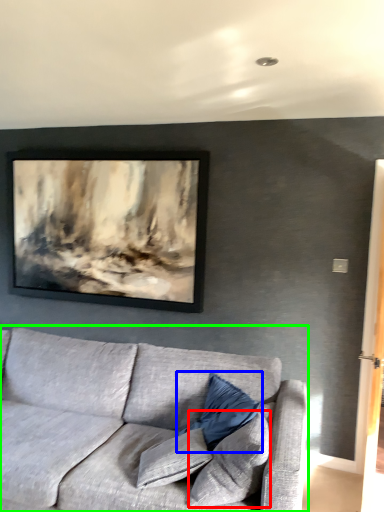
Question: Based on their relative distances, which object is farther from pillow (highlighted by a red box)? Choose from pillow (highlighted by a blue box) and studio couch (highlighted by a green box).

Choices:
 (A) pillow
 (B) studio couch

Answer: (B)